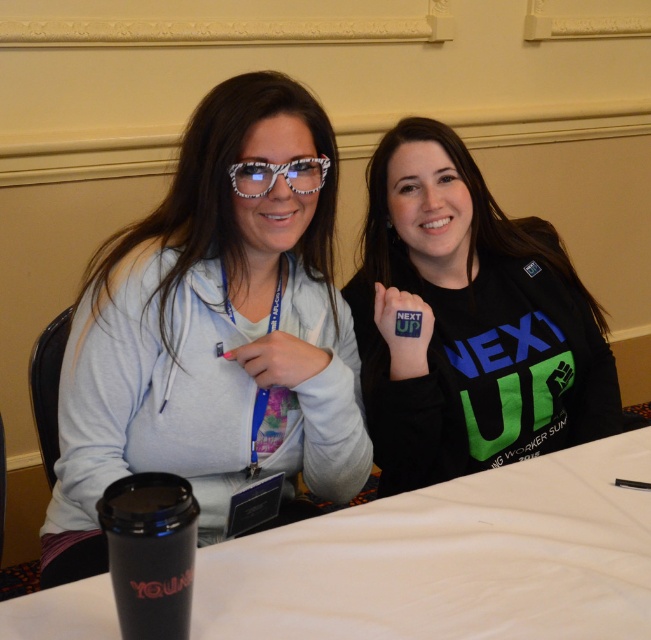
Question: Does black matte shirt at center have a greater width compared to translucent zebra-patterned glasses at center?

Choices:
 (A) no
 (B) yes

Answer: (B)

Question: Based on their relative distances, which object is nearer to the translucent zebra-patterned glasses at center?

Choices:
 (A) white matte table at center
 (B) matte gray hoodie at center
 (C) black matte shirt at center

Answer: (B)

Question: Which object appears closest to the camera in this image?

Choices:
 (A) white matte table at center
 (B) translucent zebra-patterned glasses at center
 (C) black matte shirt at center
 (D) matte gray hoodie at center

Answer: (A)

Question: Is matte gray hoodie at center smaller than white matte table at center?

Choices:
 (A) no
 (B) yes

Answer: (A)

Question: Which is farther from the white matte table at center?

Choices:
 (A) matte gray hoodie at center
 (B) black matte shirt at center
 (C) translucent zebra-patterned glasses at center

Answer: (C)

Question: Does matte gray hoodie at center appear on the right side of white matte table at center?

Choices:
 (A) no
 (B) yes

Answer: (A)